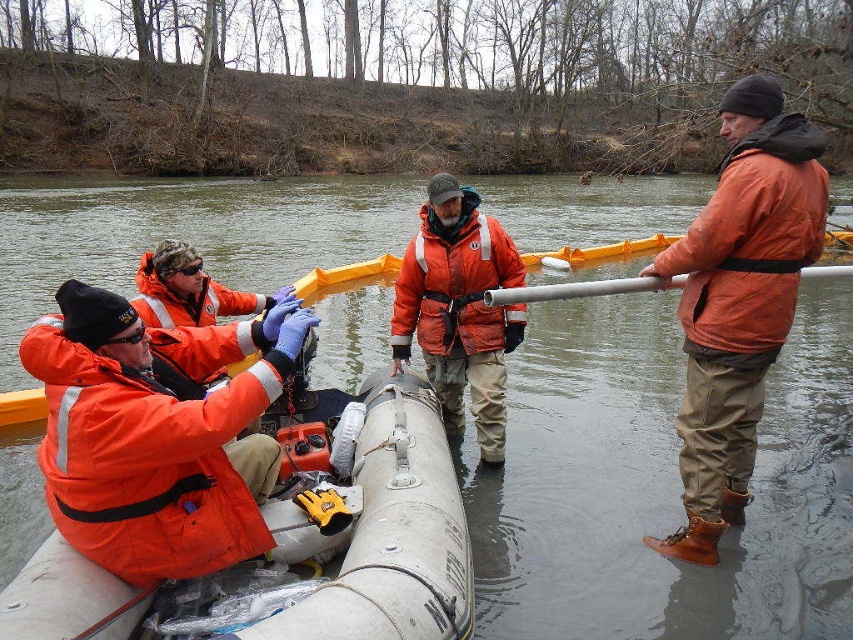
You are a member of the team and need to locate the silver metallic pipe at right. From the gray rubber tube at center, in which direction should you move to reach it?

The silver metallic pipe at right is to the right of the gray rubber tube at center, so you should move to the right to reach it.

In the scene shown: You are a safety officer on the riverbank. You need to retrieve an emergency kit from the gray rubber tube at center to give to the person wearing the orange matte jacket at center. Considering the distance between them, do you think you can walk directly to the tube, pick up the kit, and return to the person without needing assistance?

The distance between the gray rubber tube at center and the orange matte jacket at center is 61.19 feet. Walking this distance twice would be 122.38 feet total. Since this is a manageable distance for a safety officer to walk on the riverbank, you can retrieve the emergency kit from the gray rubber tube at center and return to the person wearing the orange matte jacket at center without needing assistance.